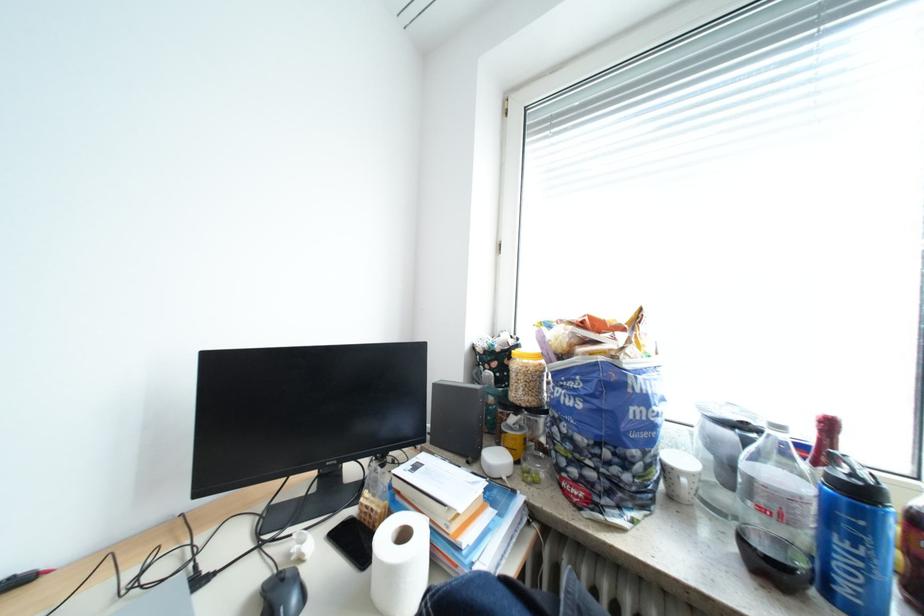
The width and height of the screenshot is (924, 616). Find the location of `black shaker lid`. black shaker lid is located at coordinates (854, 480).